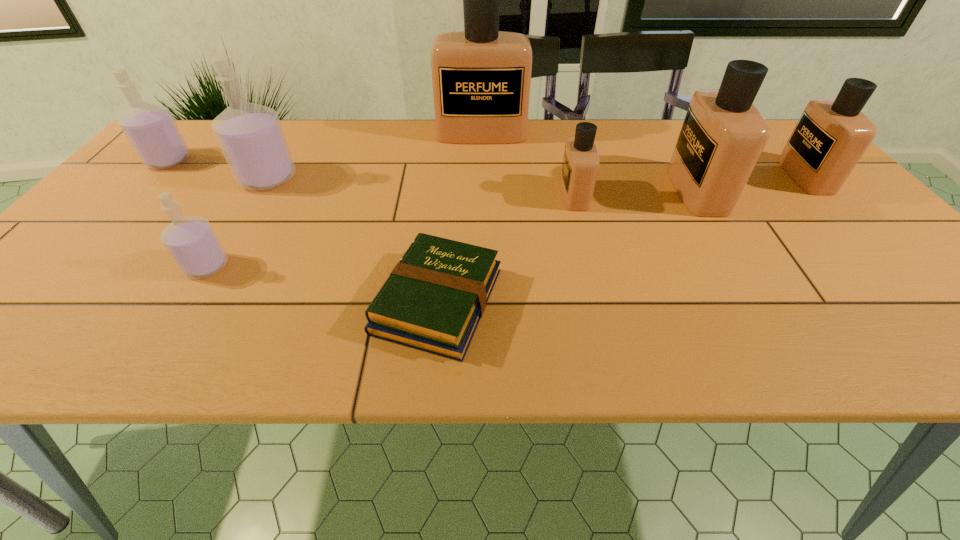
At what (x,y) coordinates should I click in order to perform the action: click on the second beige perfume from left to right. Please return your answer as a coordinate pair (x, y). The image size is (960, 540). Looking at the image, I should click on (580, 166).

Image resolution: width=960 pixels, height=540 pixels. Find the location of `the nearest perfume`. the nearest perfume is located at coordinates (192, 243).

Identify the location of the nearest purple perfume. This screenshot has width=960, height=540. (192, 243).

At what (x,y) coordinates should I click in order to perform the action: click on book. Please return your answer as a coordinate pair (x, y). The width and height of the screenshot is (960, 540). Looking at the image, I should click on (434, 298).

Locate an element on the screen. The image size is (960, 540). brown book is located at coordinates (434, 298).

Identify the location of vacant region located 0.100m on the front label of the leftmost beige perfume. (482, 164).

Where is `blank space located on the front label of the seventh object from left to right`? blank space located on the front label of the seventh object from left to right is located at coordinates (639, 190).

Identify the location of free location located 0.220m on the front label of the seventh object from left to right. (587, 190).

At what (x,y) coordinates should I click in order to perform the action: click on free region located 0.170m on the front label of the seventh object from left to right. Please return your answer as a coordinate pair (x, y). Looking at the image, I should click on coord(607,190).

The height and width of the screenshot is (540, 960). What are the coordinates of `vacant space situated on the right of the biggest purple perfume` in the screenshot? It's located at (397, 178).